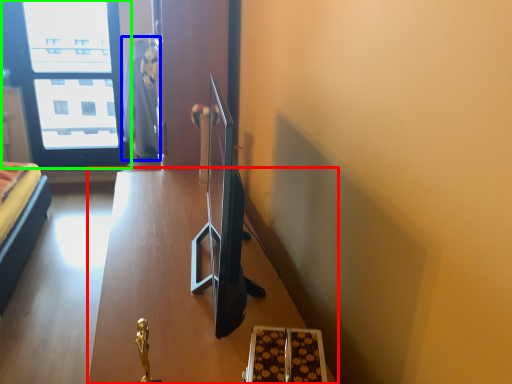
Question: Which object is positioned farthest from table (highlighted by a red box)? Select from robe (highlighted by a blue box) and window (highlighted by a green box).

Choices:
 (A) robe
 (B) window

Answer: (B)